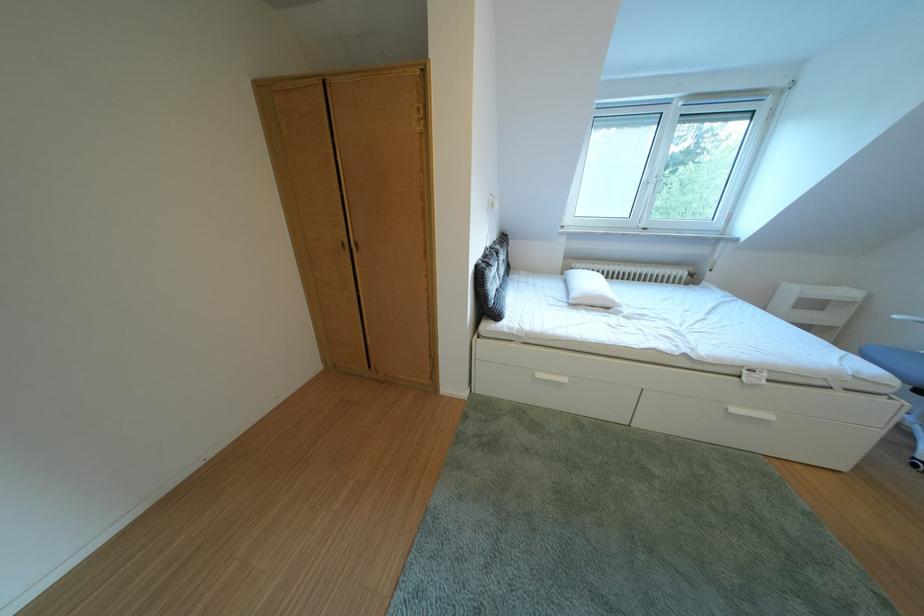
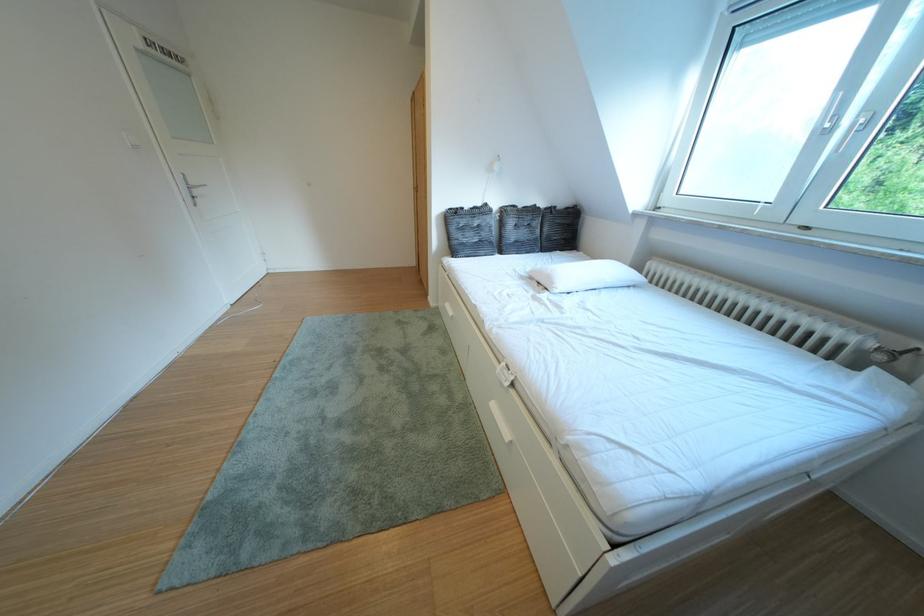
Locate, in the second image, the point that corresponds to point 553,381 in the first image.

(460, 310)